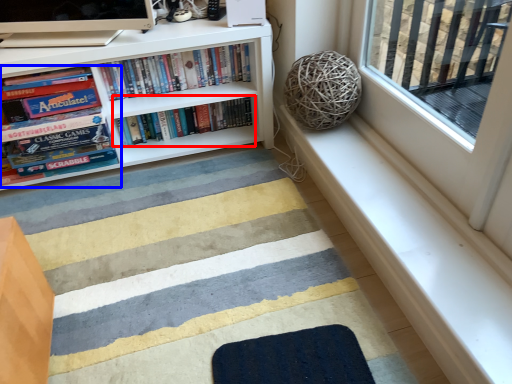
Question: Which object appears farthest to the camera in this image, book (highlighted by a red box) or book (highlighted by a blue box)?

Choices:
 (A) book
 (B) book

Answer: (A)